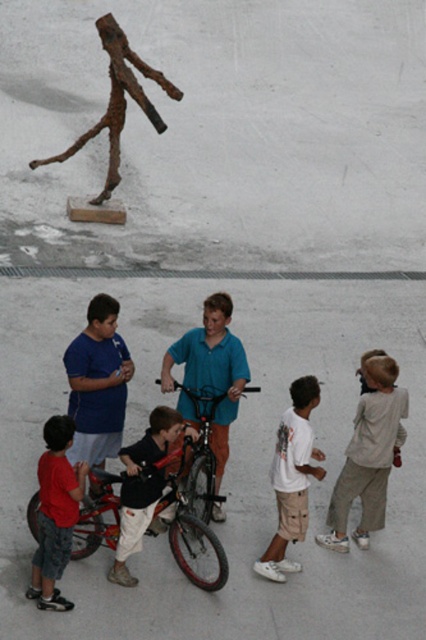
From the picture: Between light beige cotton pants at lower right and matte blue shirt at center, which one is positioned lower?

light beige cotton pants at lower right is lower down.

Who is more forward, (386, 420) or (104, 410)?

Point (386, 420)

In order to click on light beige cotton pants at lower right in this screenshot , I will do `click(368, 456)`.

Looking at this image, is dark blue shirt at center thinner than shiny metallic bicycle at center?

In fact, dark blue shirt at center might be wider than shiny metallic bicycle at center.

Does point (149, 452) lie behind point (184, 467)?

No, it is in front of (184, 467).

In order to click on dark blue shirt at center in this screenshot , I will do `click(143, 484)`.

Who is taller, light beige cotton pants at lower right or red cotton shirt at lower left?

light beige cotton pants at lower right is taller.

Is light beige cotton pants at lower right to the left of red cotton shirt at lower left from the viewer's perspective?

Incorrect, light beige cotton pants at lower right is not on the left side of red cotton shirt at lower left.

Between point (342, 509) and point (69, 545), which one is positioned behind?

The point (342, 509) is behind.

Identify the location of light beige cotton pants at lower right. Image resolution: width=426 pixels, height=640 pixels. (368, 456).